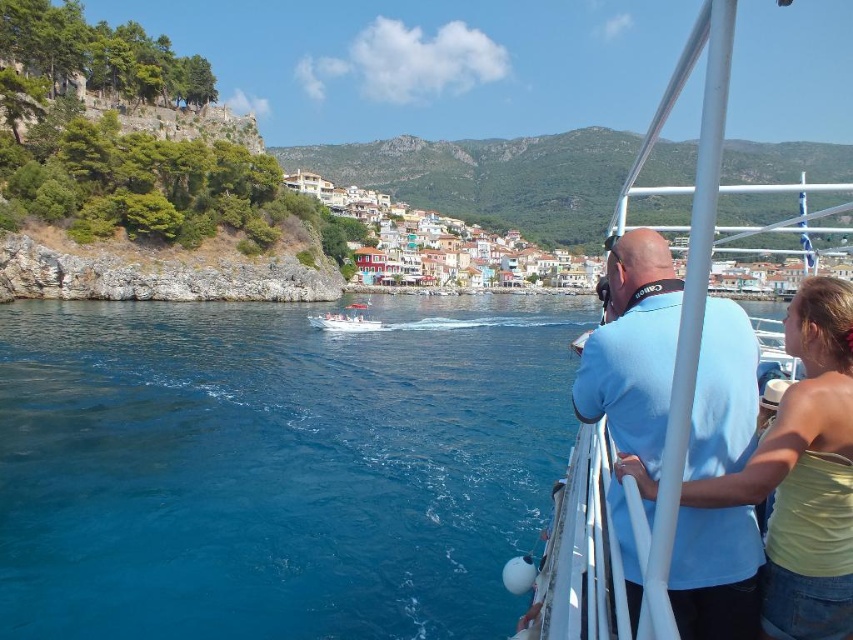
Can you confirm if yellow matte tank top at right is bigger than white plastic boat at center?

Incorrect, yellow matte tank top at right is not larger than white plastic boat at center.

Is yellow matte tank top at right taller than white plastic boat at center?

Correct, yellow matte tank top at right is much taller as white plastic boat at center.

You are a GUI agent. You are given a task and a screenshot of the screen. Output one action in this format:
    pyautogui.click(x=<x>, y=<y>)
    Task: Click on the yellow matte tank top at right
    The width and height of the screenshot is (853, 640).
    Given the screenshot: What is the action you would take?
    pyautogui.click(x=804, y=474)

Locate an element on the screen. yellow matte tank top at right is located at coordinates (804, 474).

Between light blue cotton shirt at upper right and white plastic boat at center, which one appears on the right side from the viewer's perspective?

light blue cotton shirt at upper right is more to the right.

Who is lower down, light blue cotton shirt at upper right or white plastic boat at center?

light blue cotton shirt at upper right is lower down.

Which is behind, point (605, 381) or point (363, 320)?

Positioned behind is point (363, 320).

I want to click on light blue cotton shirt at upper right, so click(633, 348).

Between white plastic boat at right and yellow matte tank top at right, which one has less height?

yellow matte tank top at right is shorter.

Identify the location of white plastic boat at right. (659, 429).